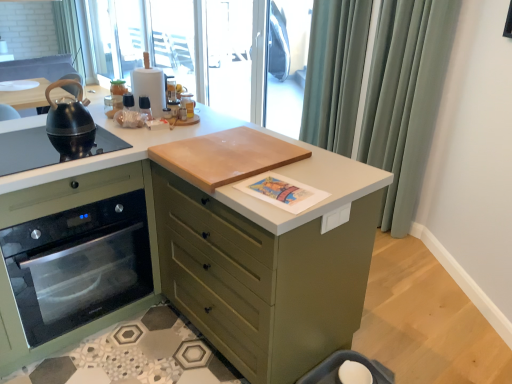
Question: Does white paper towel holder at upper center appear on the left side of black matte gas stove at left?

Choices:
 (A) yes
 (B) no

Answer: (B)

Question: Is white paper towel holder at upper center touching black matte gas stove at left?

Choices:
 (A) no
 (B) yes

Answer: (A)

Question: Considering the relative sizes of white paper towel holder at upper center and black matte gas stove at left in the image provided, is white paper towel holder at upper center thinner than black matte gas stove at left?

Choices:
 (A) yes
 (B) no

Answer: (A)

Question: Can you confirm if white paper towel holder at upper center is bigger than black matte gas stove at left?

Choices:
 (A) no
 (B) yes

Answer: (B)

Question: From the image's perspective, does white paper towel holder at upper center appear higher than black matte gas stove at left?

Choices:
 (A) no
 (B) yes

Answer: (B)

Question: Does white paper towel holder at upper center appear on the right side of black matte gas stove at left?

Choices:
 (A) no
 (B) yes

Answer: (B)

Question: Is white paper towel holder at upper center smaller than transparent glass screen door at upper center, the 1th screen door in the left-to-right sequence?

Choices:
 (A) yes
 (B) no

Answer: (A)

Question: Is the depth of white paper towel holder at upper center greater than that of transparent glass screen door at upper center, which is counted as the second screen door, starting from the right?

Choices:
 (A) yes
 (B) no

Answer: (B)

Question: Is white paper towel holder at upper center not within transparent glass screen door at upper center, the 1th screen door in the left-to-right sequence?

Choices:
 (A) no
 (B) yes

Answer: (B)

Question: From the image's perspective, is white paper towel holder at upper center above transparent glass screen door at upper center, which is counted as the second screen door, starting from the right?

Choices:
 (A) no
 (B) yes

Answer: (A)

Question: Considering the relative sizes of white paper towel holder at upper center and transparent glass screen door at upper center, which is counted as the second screen door, starting from the right, in the image provided, is white paper towel holder at upper center shorter than transparent glass screen door at upper center, which is counted as the second screen door, starting from the right,?

Choices:
 (A) no
 (B) yes

Answer: (B)

Question: Are white paper towel holder at upper center and transparent glass screen door at upper center, the 1th screen door in the left-to-right sequence, located far from each other?

Choices:
 (A) yes
 (B) no

Answer: (A)

Question: From a real-world perspective, is satin fabric curtain at upper right over satin green oven at left?

Choices:
 (A) yes
 (B) no

Answer: (A)